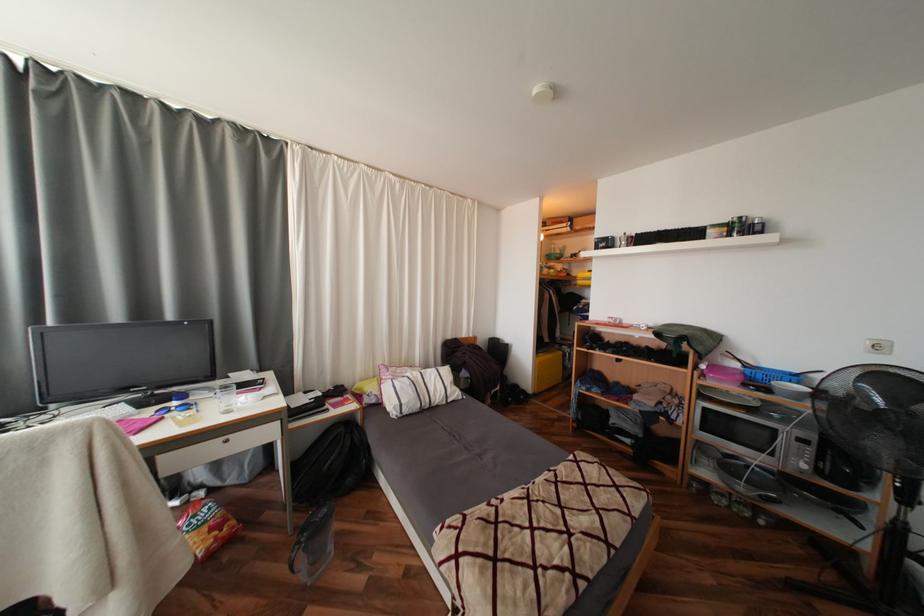
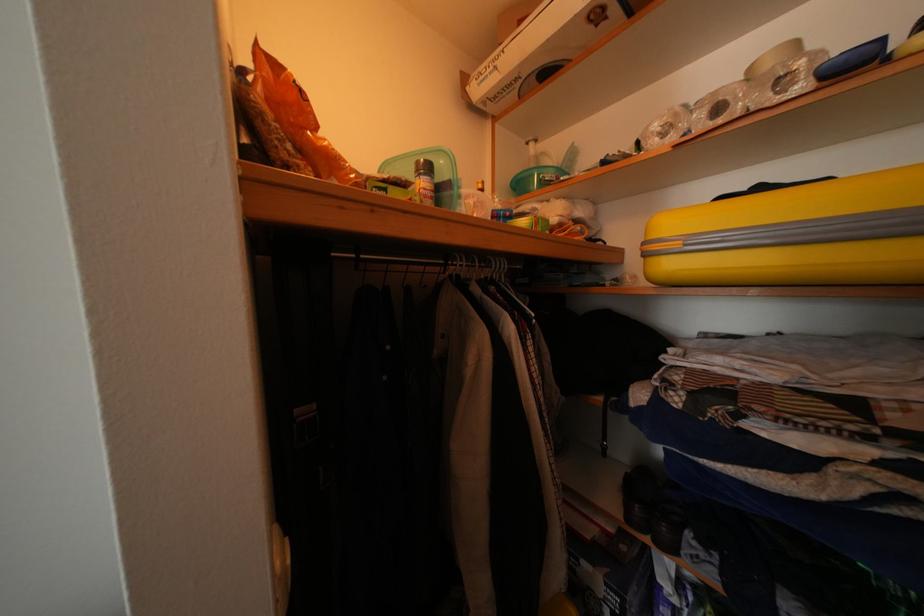
The images are taken continuously from a first-person perspective. In which direction are you moving?

The cameraman walked toward right, forward.